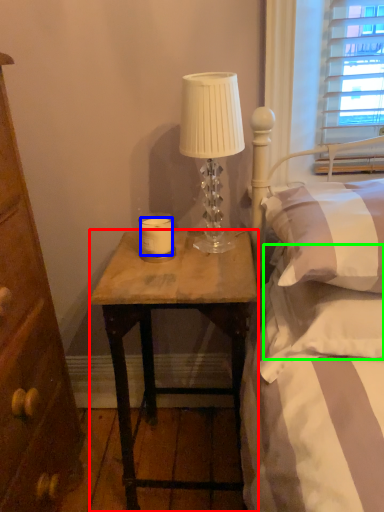
Question: Based on their relative distances, which object is farther from desk (highlighted by a red box)? Choose from candle (highlighted by a blue box) and pillow (highlighted by a green box).

Choices:
 (A) candle
 (B) pillow

Answer: (A)